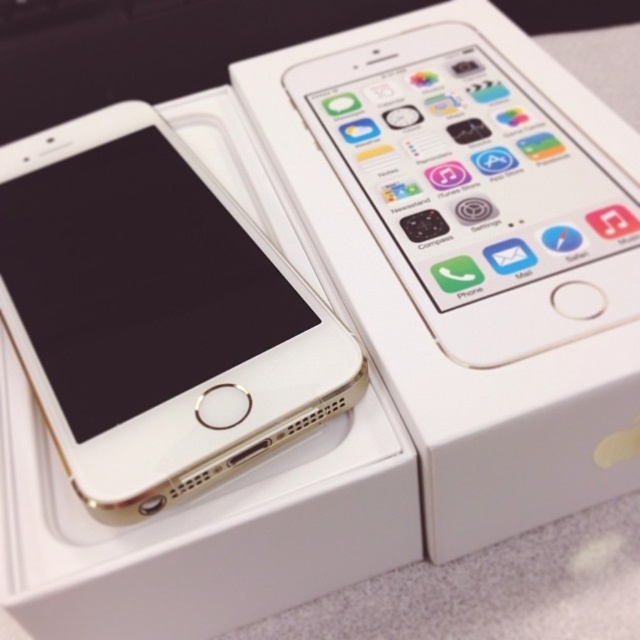
You are comparing two gold smartphones in a store display. You see the gold matte smartphone at upper left and the gold metallic smartphone at upper center. Which one is taller?

The gold matte smartphone at upper left is taller than the gold metallic smartphone at upper center.

You are holding a measuring tape and want to measure the distance between yourself and the gold matte smartphone at upper left in the image. According to the scene description, can you determine the exact distance?

The gold matte smartphone at upper left is 1.05 meters away from the viewer, so the exact distance is 1.05 meters.